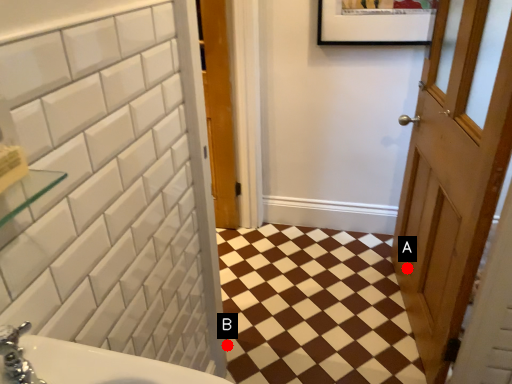
Question: Two points are circled on the image, labeled by A and B beside each circle. Which point appears farthest from the camera in this image?

Choices:
 (A) A is further
 (B) B is further

Answer: (A)